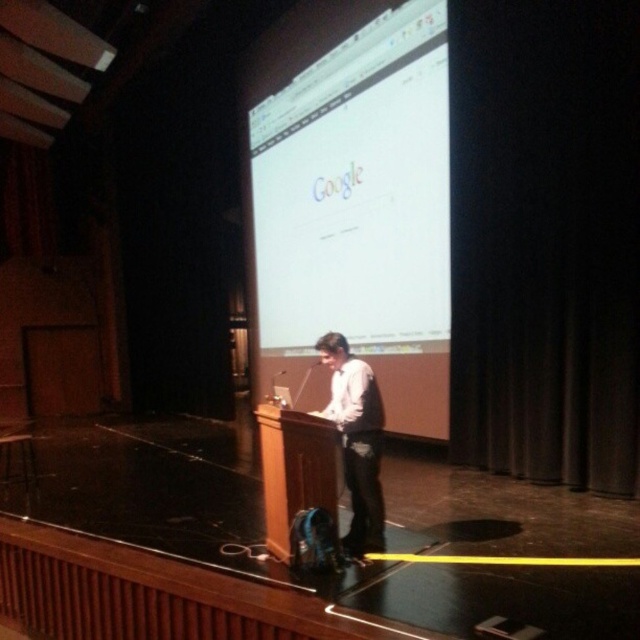
Is white glossy projector screen at center taller than light brown shirt at center?

Yes, white glossy projector screen at center is taller than light brown shirt at center.

Based on the photo, can you confirm if white glossy projector screen at center is positioned below light brown shirt at center?

No.

This screenshot has height=640, width=640. What do you see at coordinates (356, 192) in the screenshot? I see `white glossy projector screen at center` at bounding box center [356, 192].

This screenshot has width=640, height=640. What are the coordinates of `white glossy projector screen at center` in the screenshot? It's located at (356, 192).